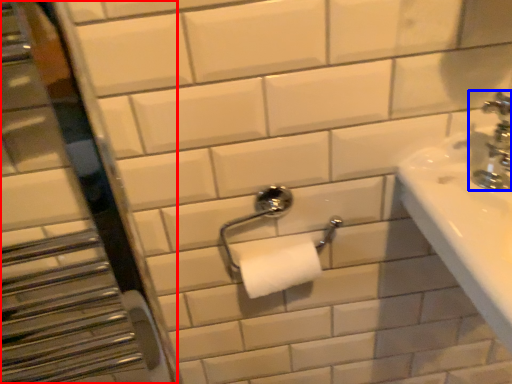
Question: Among these objects, which one is nearest to the camera, mirror (highlighted by a red box) or tap (highlighted by a blue box)?

Choices:
 (A) mirror
 (B) tap

Answer: (A)